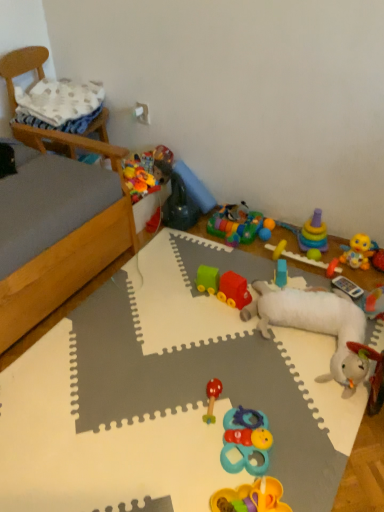
Image resolution: width=384 pixels, height=512 pixels. Find the location of `blank space situated above multicolored plastic blocks at center, acting as the ninth toy starting from the bottom (from a real-world perspective)`. blank space situated above multicolored plastic blocks at center, acting as the ninth toy starting from the bottom (from a real-world perspective) is located at coordinates (236, 216).